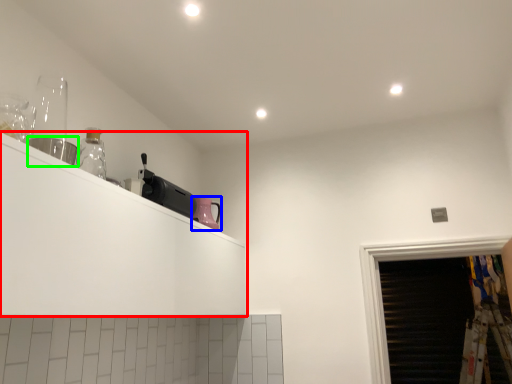
Question: Which object is positioned closest to shelf (highlighted by a red box)? Select from appliance (highlighted by a blue box) and appliance (highlighted by a green box).

Choices:
 (A) appliance
 (B) appliance

Answer: (B)